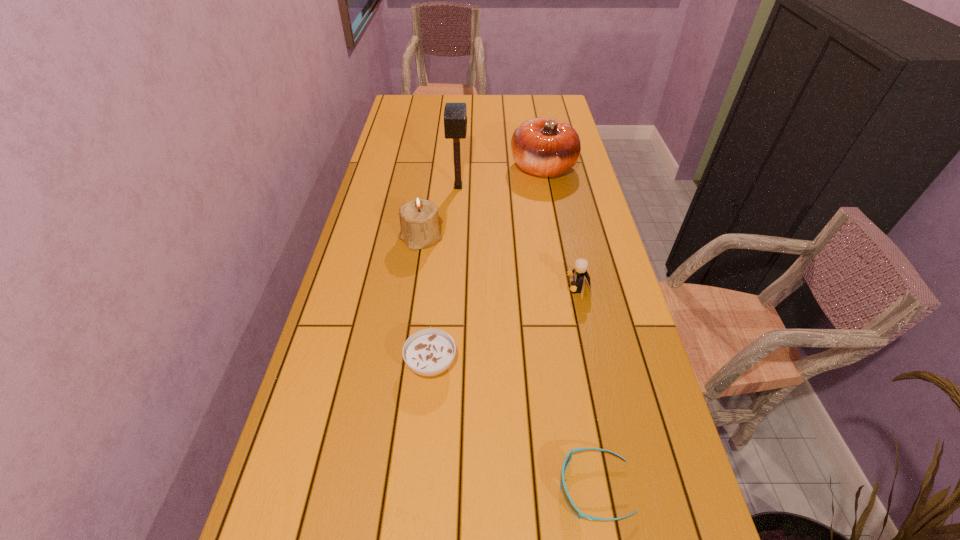
Identify the location of the tallest object. (455, 117).

Identify the location of pumpkin. (545, 147).

Locate an element on the screen. The image size is (960, 540). candle_holder is located at coordinates (419, 222).

What are the coordinates of `the third shortest object` in the screenshot? It's located at [581, 265].

The width and height of the screenshot is (960, 540). What are the coordinates of `Lego` in the screenshot? It's located at (581, 265).

This screenshot has height=540, width=960. I want to click on soup bowl, so click(x=428, y=352).

Find the location of `the second nearest object`. the second nearest object is located at coordinates point(428,352).

In order to click on the shortest object in this screenshot , I will do `click(568, 457)`.

The image size is (960, 540). Identify the location of the nearest object. (568, 457).

You are a GUI agent. You are given a task and a screenshot of the screen. Output one action in this format:
    pyautogui.click(x=<x>, y=<y>)
    Task: Click on the free location located 0.220m on the left of the mallet
    The image size is (960, 540).
    Given the screenshot: What is the action you would take?
    pyautogui.click(x=387, y=187)